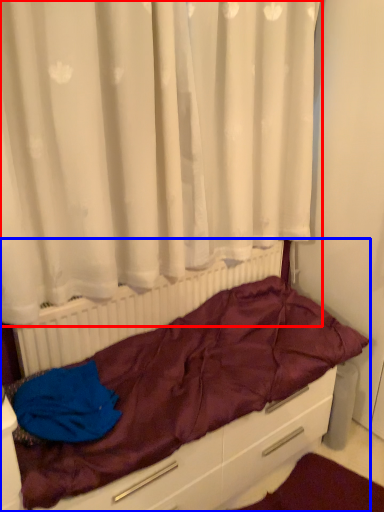
Question: Which object appears farthest to the camera in this image, curtain (highlighted by a red box) or furniture (highlighted by a blue box)?

Choices:
 (A) curtain
 (B) furniture

Answer: (B)